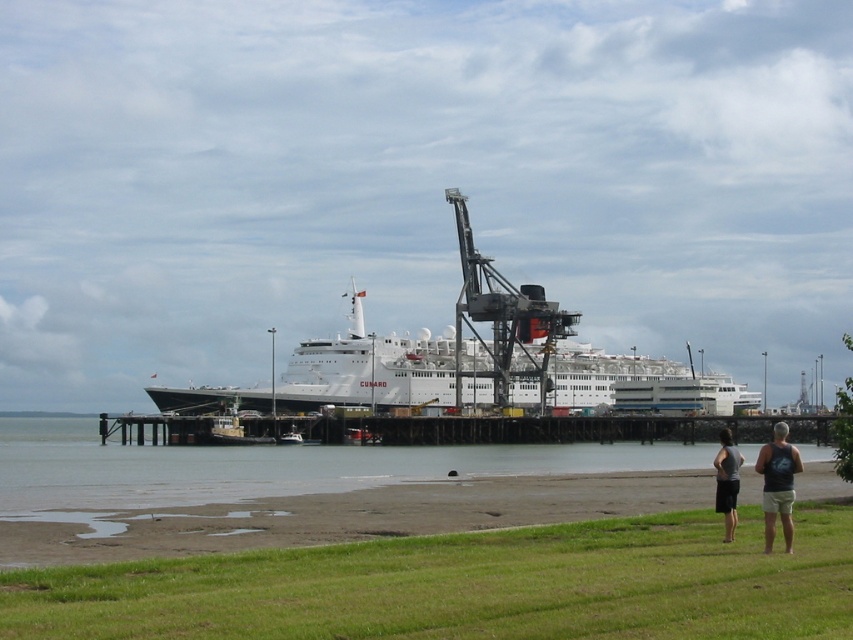
Question: Based on their relative distances, which object is farther from the dark gray tank top at lower right?

Choices:
 (A) white glossy cruise ship at center
 (B) wooden dock at center
 (C) dark gray fabric shorts at lower right

Answer: (A)

Question: Can you confirm if wooden dock at center is smaller than dark gray fabric shorts at lower right?

Choices:
 (A) yes
 (B) no

Answer: (A)

Question: Which point is closer to the camera taking this photo?

Choices:
 (A) (619, 433)
 (B) (721, 481)
 (C) (459, 380)

Answer: (B)

Question: Is white glossy cruise ship at center thinner than dark gray tank top at lower right?

Choices:
 (A) no
 (B) yes

Answer: (A)

Question: Is white glossy cruise ship at center thinner than wooden dock at center?

Choices:
 (A) yes
 (B) no

Answer: (B)

Question: Which point is farther to the camera?

Choices:
 (A) dark gray tank top at lower right
 (B) dark gray fabric shorts at lower right
 (C) white glossy cruise ship at center

Answer: (C)